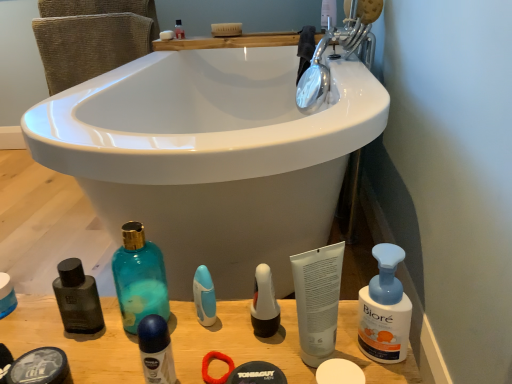
Locate an element on the screen. spots to the right of matte black bottle at lower left is located at coordinates (59, 325).